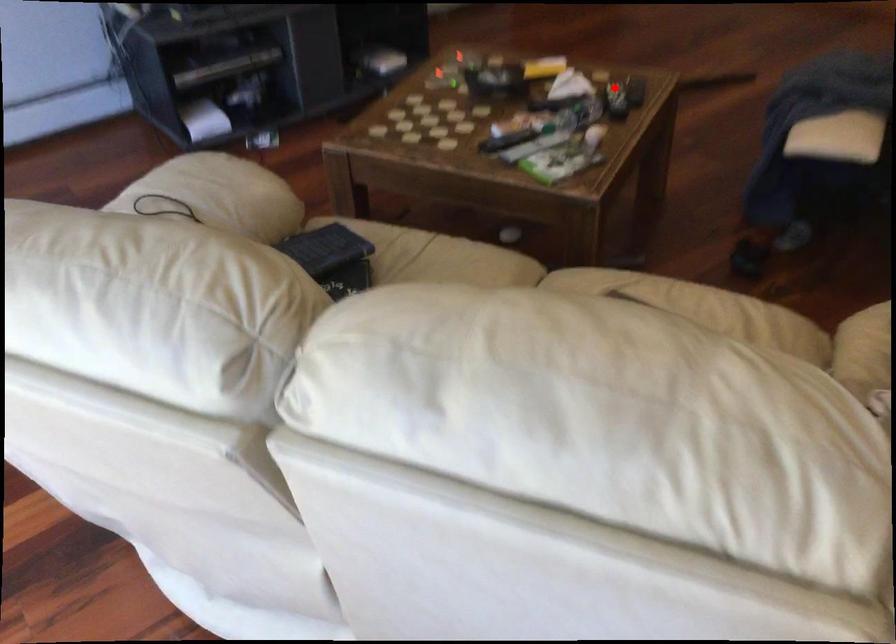
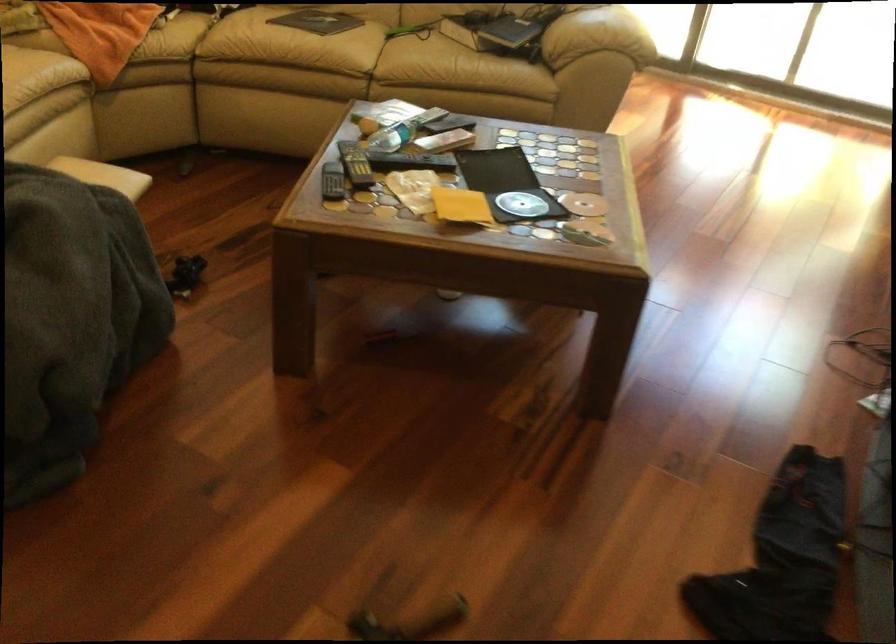
Question: I am providing you with two images of the same scene from different viewpoints. Given a red point in image1, look at the same physical point in image2. Is it:

Choices:
 (A) Closer to the viewpoint
 (B) Farther from the viewpoint

Answer: (A)